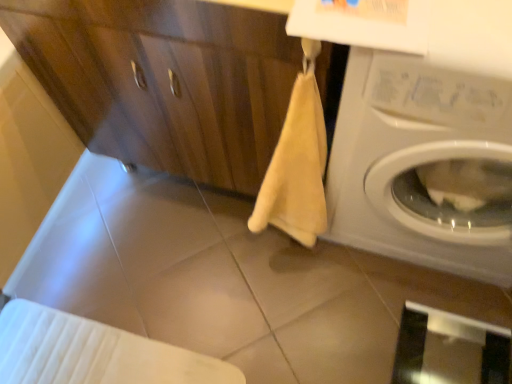
Question: Is point (352, 165) positioned closer to the camera than point (193, 79)?

Choices:
 (A) farther
 (B) closer

Answer: (A)

Question: Is white glossy washing machine at right wider or thinner than matte wood dresser at center?

Choices:
 (A) wide
 (B) thin

Answer: (B)

Question: Based on their relative distances, which object is farther from the transparent glass screen door at lower right?

Choices:
 (A) matte wood dresser at center
 (B) beige matte tile at center
 (C) white glossy washing machine at right

Answer: (A)

Question: Which object is the farthest from the matte wood dresser at center?

Choices:
 (A) transparent glass screen door at lower right
 (B) white glossy washing machine at right
 (C) beige matte tile at center

Answer: (A)